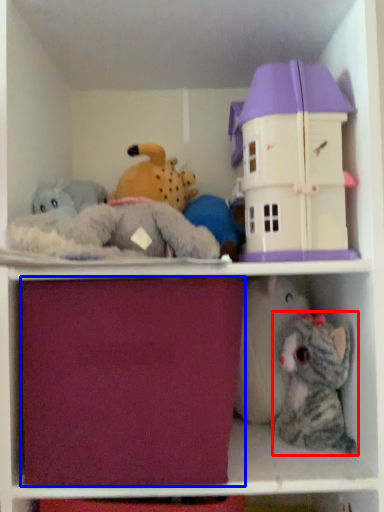
Question: Which point is closer to the camera, toy (highlighted by a red box) or drawer (highlighted by a blue box)?

Choices:
 (A) toy
 (B) drawer

Answer: (B)